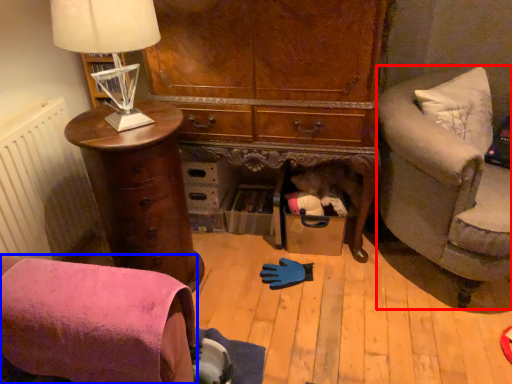
Question: Which of the following is the closest to the observer, studio couch (highlighted by a red box) or chair (highlighted by a blue box)?

Choices:
 (A) studio couch
 (B) chair

Answer: (B)